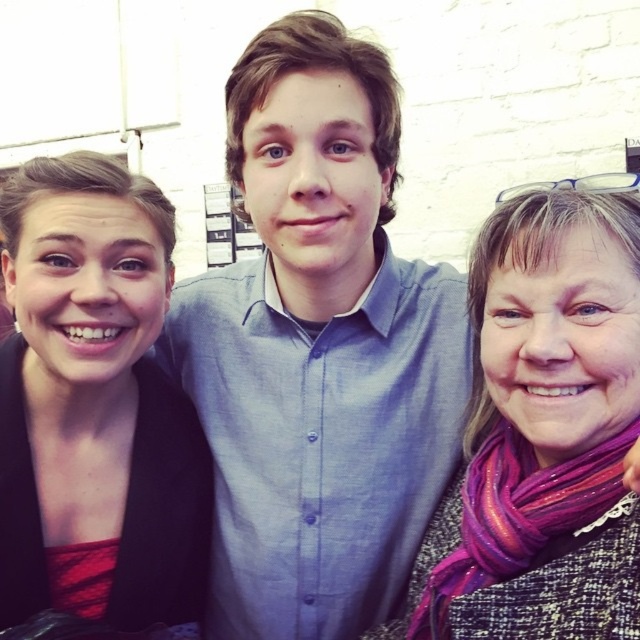
Is point (451, 317) less distant than point (42, 604)?

That is False.

Is point (412, 424) behind point (157, 522)?

Yes, it is behind point (157, 522).

The height and width of the screenshot is (640, 640). What are the coordinates of `blue cotton shirt at center` in the screenshot? It's located at (317, 348).

Is matte black jacket at left to the right of purple glitter scarf at center from the viewer's perspective?

In fact, matte black jacket at left is to the left of purple glitter scarf at center.

Between matte black jacket at left and purple glitter scarf at center, which one is positioned higher?

matte black jacket at left

Between point (189, 504) and point (604, 403), which one is positioned in front?

Point (604, 403) is in front.

Where is `matte black jacket at left`? Image resolution: width=640 pixels, height=640 pixels. matte black jacket at left is located at coordinates pyautogui.click(x=93, y=404).

Can you confirm if blue cotton shirt at center is positioned above purple glitter scarf at center?

Indeed, blue cotton shirt at center is positioned over purple glitter scarf at center.

Which of these two, blue cotton shirt at center or purple glitter scarf at center, stands taller?

With more height is blue cotton shirt at center.

Is point (364, 106) closer to camera compared to point (621, 230)?

No, (364, 106) is further to viewer.

This screenshot has height=640, width=640. I want to click on blue cotton shirt at center, so click(x=317, y=348).